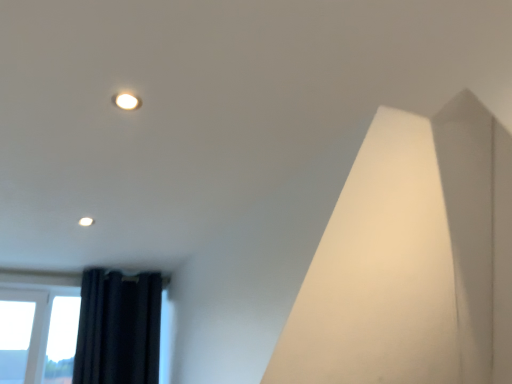
Describe the element at coordinates (118, 329) in the screenshot. I see `dark blue fabric curtain at lower left` at that location.

Where is `dark blue fabric curtain at lower left`? This screenshot has height=384, width=512. dark blue fabric curtain at lower left is located at coordinates (118, 329).

Find the location of a particular element. The image size is (512, 384). dark blue fabric curtain at lower left is located at coordinates (118, 329).